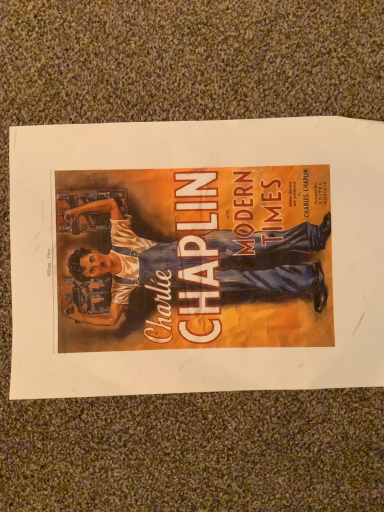
Where is `matte paper poster at center`? The width and height of the screenshot is (384, 512). matte paper poster at center is located at coordinates (197, 256).

The height and width of the screenshot is (512, 384). Describe the element at coordinates (197, 256) in the screenshot. I see `matte paper poster at center` at that location.

Where is `matte paper poster at center`? Image resolution: width=384 pixels, height=512 pixels. matte paper poster at center is located at coordinates (197, 256).